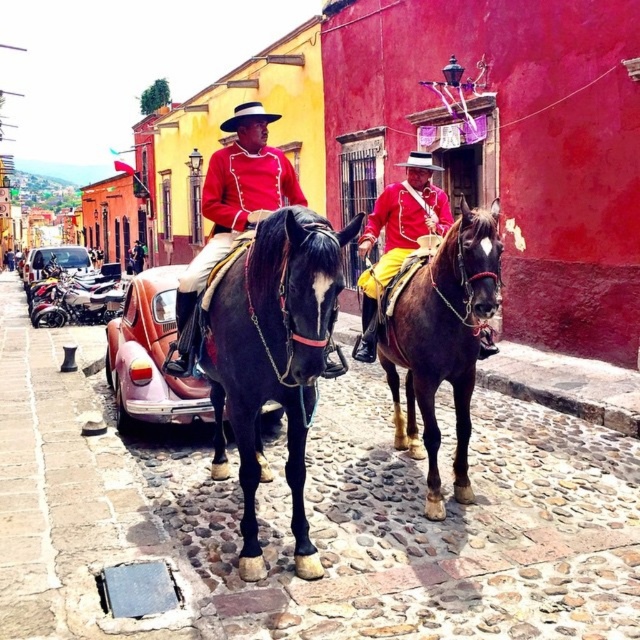
Can you confirm if black glossy horse at center is smaller than shiny gold pants at center?

No, black glossy horse at center is not smaller than shiny gold pants at center.

Which of these two, black glossy horse at center or shiny gold pants at center, stands taller?

black glossy horse at center

Does point (256, 353) lie in front of point (388, 257)?

That is True.

Where is `black glossy horse at center`? black glossy horse at center is located at coordinates (273, 358).

The width and height of the screenshot is (640, 640). I want to click on black glossy horse at center, so click(x=273, y=358).

Can you confirm if black glossy horse at center is wider than brown glossy horse at center?

Correct, the width of black glossy horse at center exceeds that of brown glossy horse at center.

Which is behind, point (282, 209) or point (410, 396)?

The point (410, 396) is more distant.

You are a GUI agent. You are given a task and a screenshot of the screen. Output one action in this format:
    pyautogui.click(x=<x>, y=<y>)
    Task: Click on the black glossy horse at center
    Image resolution: width=640 pixels, height=640 pixels.
    Given the screenshot: What is the action you would take?
    pyautogui.click(x=273, y=358)

You are a GUI agent. You are given a task and a screenshot of the screen. Output one action in this format:
    pyautogui.click(x=<x>, y=<y>)
    Task: Click on the brown glossy horse at center
    This screenshot has height=640, width=640.
    Given the screenshot: What is the action you would take?
    pyautogui.click(x=442, y=342)

The height and width of the screenshot is (640, 640). Describe the element at coordinates (442, 342) in the screenshot. I see `brown glossy horse at center` at that location.

At what (x,y) coordinates should I click in order to perform the action: click on brown glossy horse at center. Please return your answer as a coordinate pair (x, y). The image size is (640, 640). Looking at the image, I should click on (442, 342).

The image size is (640, 640). Identify the location of brown glossy horse at center. (442, 342).